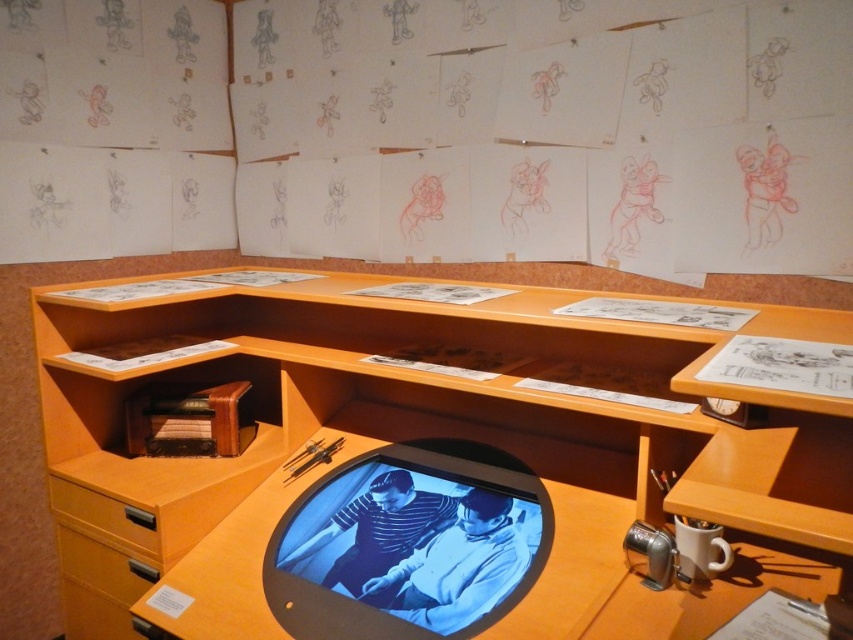
Question: Does matte wood shelf at center appear under matte wood drawer at lower left?

Choices:
 (A) yes
 (B) no

Answer: (B)

Question: Is orange wood drawer at lower left behind matte wood drawer at lower left?

Choices:
 (A) no
 (B) yes

Answer: (B)

Question: Which is nearer to the matte wood shelf at center?

Choices:
 (A) orange wood drawer at lower left
 (B) blue glossy computer monitor at center

Answer: (B)

Question: Does blue glossy computer monitor at center come behind orange wood drawer at lower left?

Choices:
 (A) no
 (B) yes

Answer: (A)

Question: Which object appears farthest from the camera in this image?

Choices:
 (A) matte wood shelf at center
 (B) matte wood drawer at lower left
 (C) orange wood drawer at lower left

Answer: (C)

Question: Estimate the real-world distances between objects in this image. Which object is closer to the blue glossy computer monitor at center?

Choices:
 (A) matte wood shelf at center
 (B) matte wood drawer at lower left

Answer: (A)